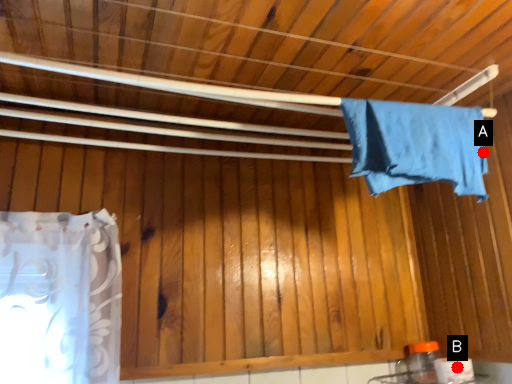
Question: Two points are circled on the image, labeled by A and B beside each circle. Which point is further to the camera?

Choices:
 (A) A is further
 (B) B is further

Answer: (B)